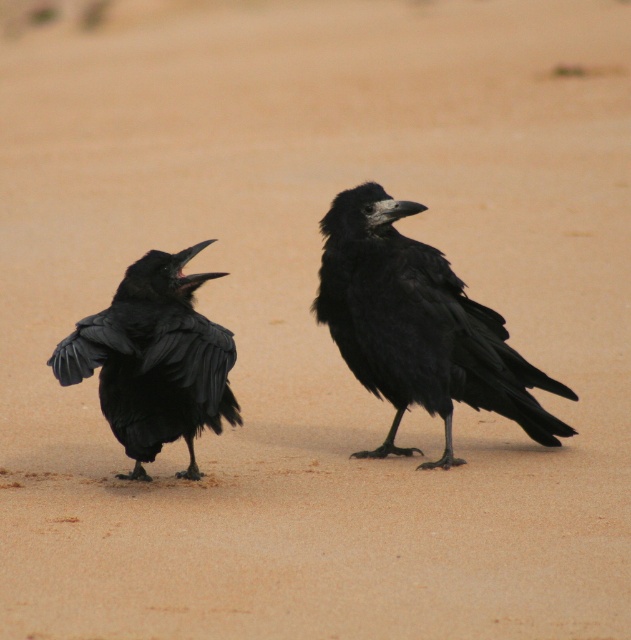
You are a birdwatcher observing two shiny black ravens in a desert. The shiny black raven at center and the shiny black raven at left are both visible. Based on their positions, which raven is positioned higher up in the image?

The shiny black raven at center is located above the shiny black raven at left, so it is positioned higher up in the image.

You are a birdwatcher observing two shiny black ravens in a desert. The shiny black raven at center and the shiny black raven at left are both in your view. Which of the two shiny black ravens is taller?

The shiny black raven at center is much taller than the shiny black raven at left.

You are a photographer standing in the desert and see the shiny black raven at center. You want to take a closeup photo of it. Considering the distance, can you get a clear closeup without moving closer?

The shiny black raven at center is 15.62 feet from camera. A distance of 15.62 feet may be too far for a standard camera lens to capture a clear closeup without zoom capabilities. You might need a telephoto lens or move closer to get a clearer image.